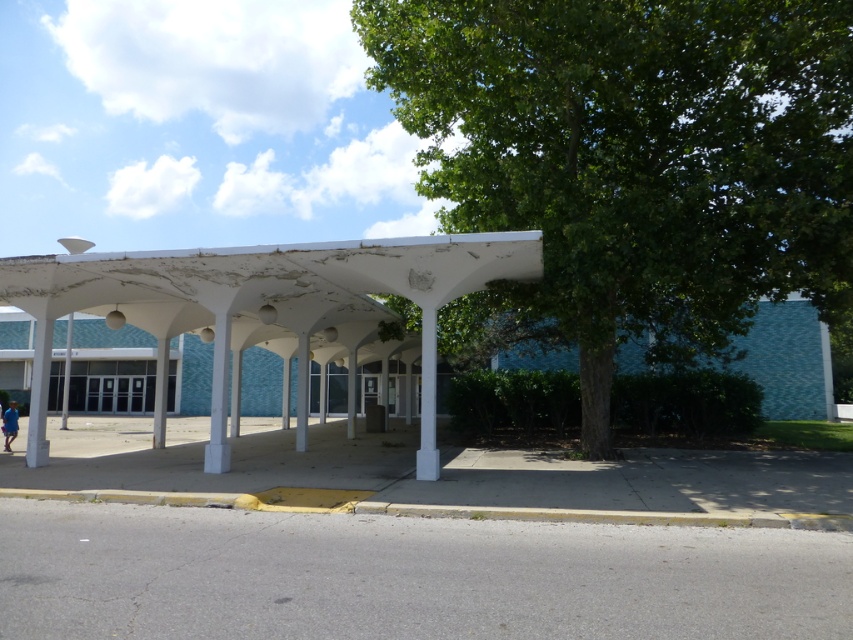
Question: Which of the following is the farthest from the observer?

Choices:
 (A) white smooth column at center
 (B) green leafy tree at center
 (C) smooth gray pole at left

Answer: (C)

Question: Which point is farther to the camera?

Choices:
 (A) (9, 440)
 (B) (39, 364)
 (C) (434, 339)

Answer: (A)

Question: Can you confirm if green leafy tree at center is bigger than white matte pergola at center?

Choices:
 (A) no
 (B) yes

Answer: (B)

Question: Can you confirm if green leafy tree at center is positioned to the left of white matte pergola at center?

Choices:
 (A) no
 (B) yes

Answer: (A)

Question: Is green leafy tree at center bigger than smooth gray pole at left?

Choices:
 (A) no
 (B) yes

Answer: (B)

Question: Which of the following is the closest to the observer?

Choices:
 (A) green leafy tree at center
 (B) blue fabric at left
 (C) white smooth column at center
 (D) white matte pergola at center

Answer: (D)